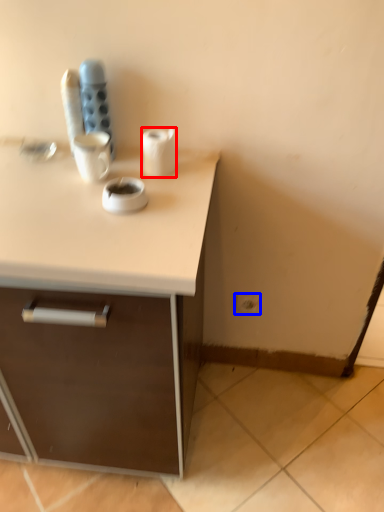
Question: Among these objects, which one is farthest to the camera, paper towel (highlighted by a red box) or electric outlet (highlighted by a blue box)?

Choices:
 (A) paper towel
 (B) electric outlet

Answer: (B)